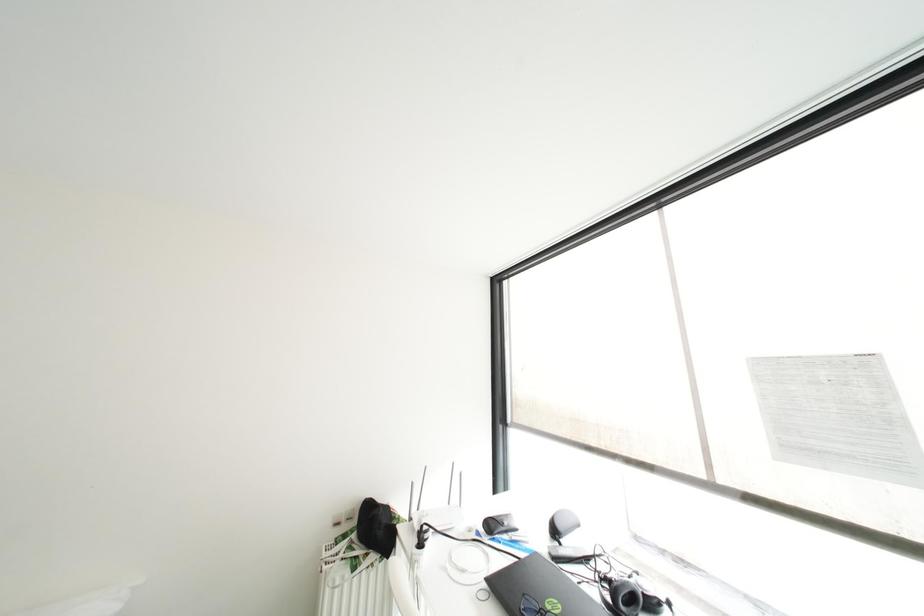
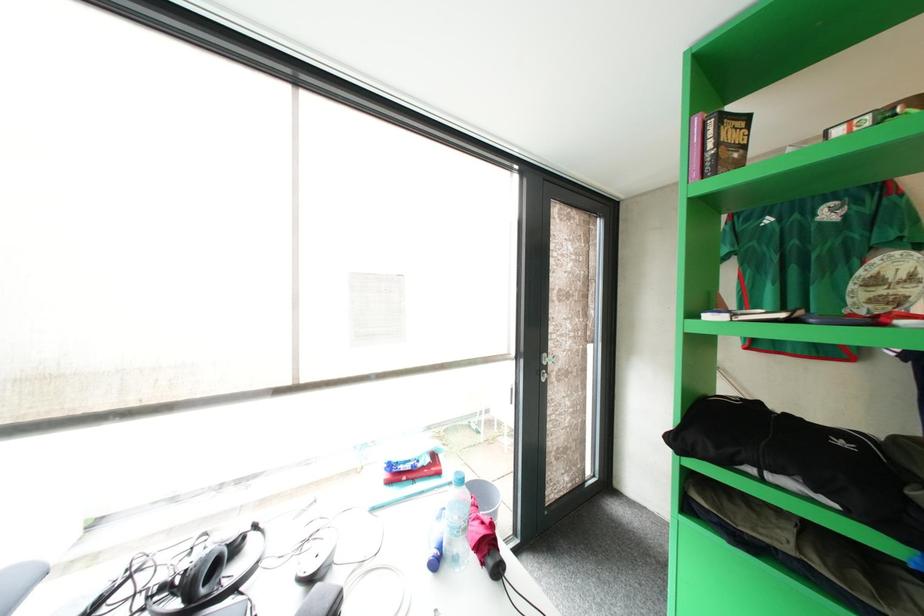
Question: How did the camera likely rotate?

Choices:
 (A) Left
 (B) Right
 (C) Up
 (D) Down

Answer: (B)